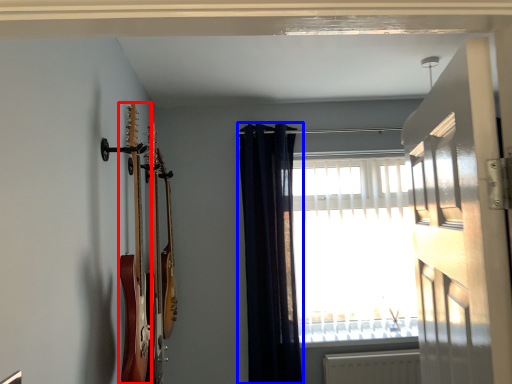
Question: Which of the following is the farthest to the observer, guitar (highlighted by a red box) or curtain (highlighted by a blue box)?

Choices:
 (A) guitar
 (B) curtain

Answer: (B)